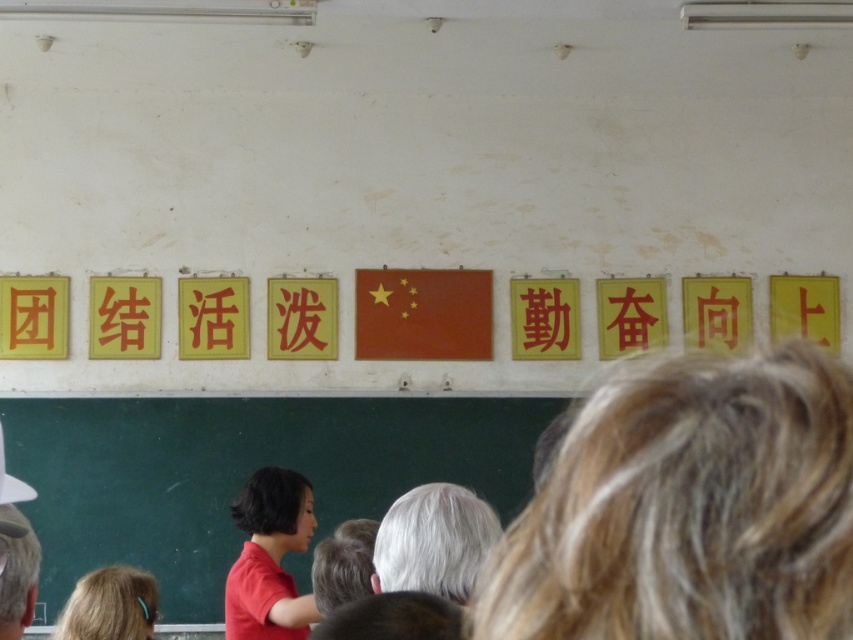
Question: Which of these objects is positioned farthest from the green chalkboard at center?

Choices:
 (A) gray hair at center
 (B) red matte shirt at center
 (C) blonde hair at lower left
 (D) blonde hair at center

Answer: (D)

Question: Which point appears farthest from the camera in this image?

Choices:
 (A) (482, 620)
 (B) (247, 627)

Answer: (B)

Question: Can you confirm if blonde hair at center is bigger than red matte shirt at center?

Choices:
 (A) yes
 (B) no

Answer: (B)

Question: Which object is farther from the camera taking this photo?

Choices:
 (A) green chalkboard at center
 (B) gray hair at center
 (C) blonde hair at center
 (D) red matte shirt at center

Answer: (A)

Question: Does gray hair at center come behind blonde hair at lower left?

Choices:
 (A) yes
 (B) no

Answer: (B)

Question: Where is red matte shirt at center located in relation to gray hair at center in the image?

Choices:
 (A) below
 (B) above

Answer: (A)